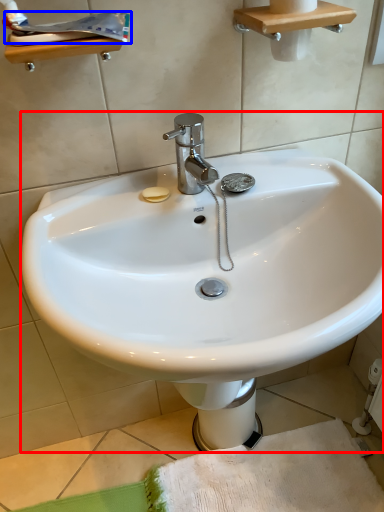
Question: Which of the following is the closest to the observer, sink (highlighted by a red box) or toothpaste (highlighted by a blue box)?

Choices:
 (A) sink
 (B) toothpaste

Answer: (A)